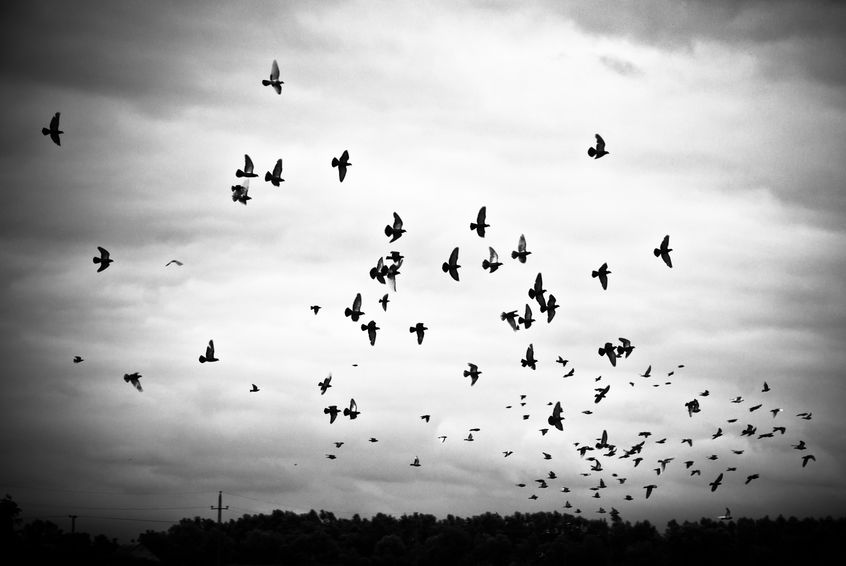
This screenshot has width=846, height=566. I want to click on cable, so click(x=243, y=497).